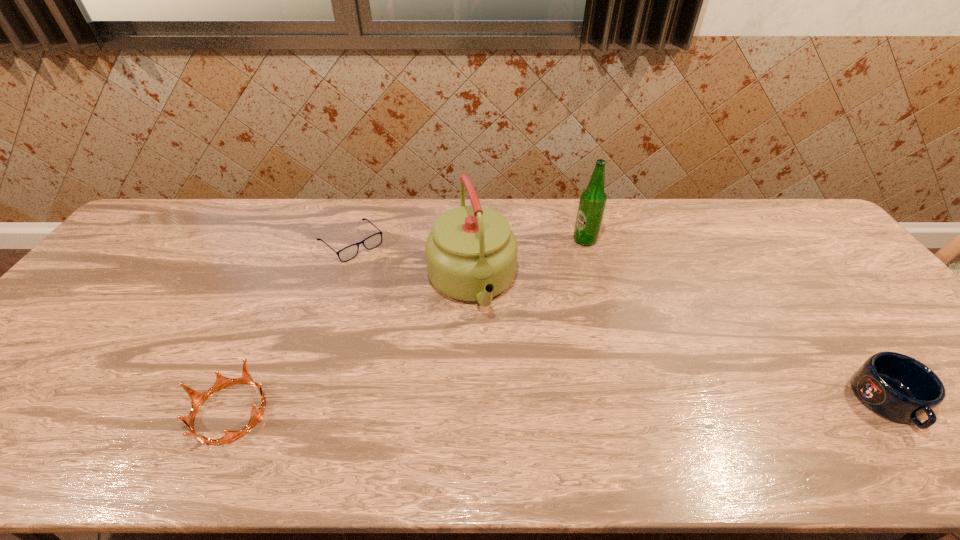
The height and width of the screenshot is (540, 960). In order to click on vacant spot on the desktop that is between the crown and the mug and is positioned at the spout of the kettle in this screenshot , I will do `click(514, 408)`.

The image size is (960, 540). Identify the location of free space on the desktop that is between the crown and the mug and is positioned on the front-facing side of the shortest object. (525, 408).

This screenshot has width=960, height=540. Identify the location of vacant space on the desktop that is between the crown and the rightmost object and is positioned on the label of the beer bottle. (513, 408).